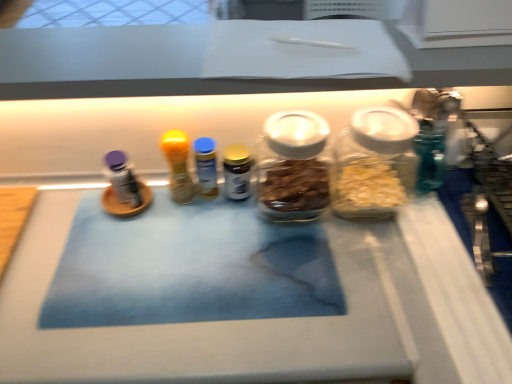
Question: In terms of height, does gold metallic spice jar at center, which is counted as the third bottle, starting from the right, look taller or shorter compared to blue plastic bottle at center, the second bottle viewed from the left?

Choices:
 (A) short
 (B) tall

Answer: (A)

Question: From a real-world perspective, is gold metallic spice jar at center, the third bottle from the left, physically located above or below blue plastic bottle at center, the second bottle viewed from the left?

Choices:
 (A) below
 (B) above

Answer: (A)

Question: Estimate the real-world distances between objects in this image. Which object is closer to the blue plastic bottle at center, the second bottle viewed from the left?

Choices:
 (A) yellow matte bottle at center, marked as the 1th bottle in a left-to-right arrangement
 (B) transparent glass jar at center, the 4th bottle when ordered from left to right
 (C) gold metallic spice jar at center, which is counted as the third bottle, starting from the right
 (D) translucent glass jar at right, marked as the fifth bottle in a left-to-right arrangement
 (E) blue marble table at center

Answer: (A)

Question: Which is nearer to the translucent glass jar at right, marked as the fifth bottle in a left-to-right arrangement?

Choices:
 (A) transparent glass jar at center, which appears as the 2th bottle when viewed from the right
 (B) blue marble table at center
 (C) gold metallic spice jar at center, which is counted as the third bottle, starting from the right
 (D) yellow matte bottle at center, marked as the 1th bottle in a left-to-right arrangement
 (E) blue plastic bottle at center, the second bottle viewed from the left

Answer: (A)